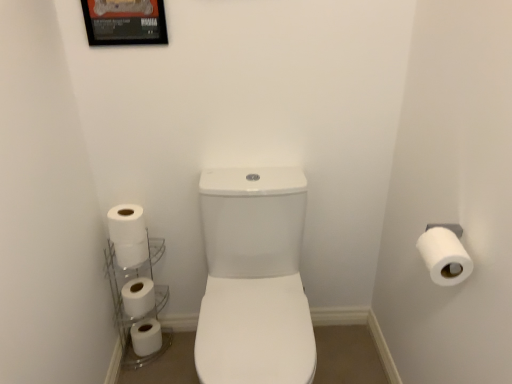
Find the location of a particular element. The height and width of the screenshot is (384, 512). vacant space in front of clear glass shelves at lower left is located at coordinates (151, 374).